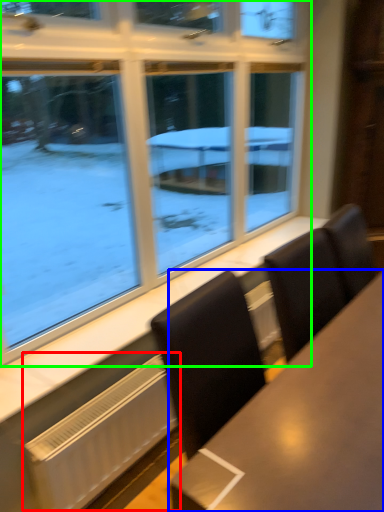
Question: Estimate the real-world distances between objects in this image. Which object is farther from radiator (highlighted by a red box), table (highlighted by a blue box) or window (highlighted by a green box)?

Choices:
 (A) table
 (B) window

Answer: (B)